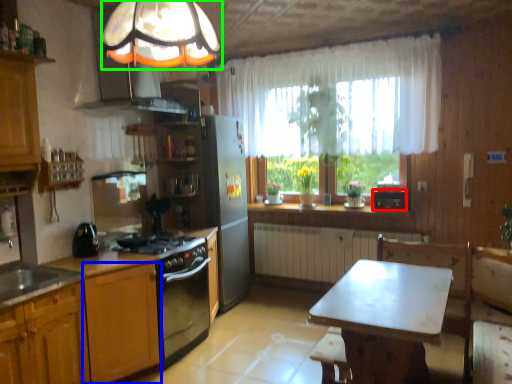
Question: Which object is the farthest from appliance (highlighted by a red box)? Choose among these: cabinetry (highlighted by a blue box) or fixture (highlighted by a green box).

Choices:
 (A) cabinetry
 (B) fixture

Answer: (B)